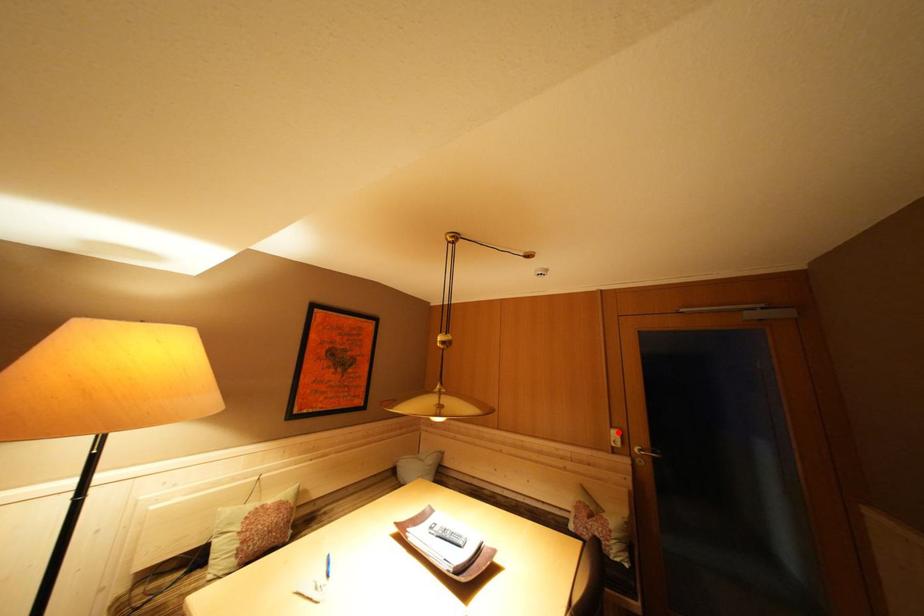
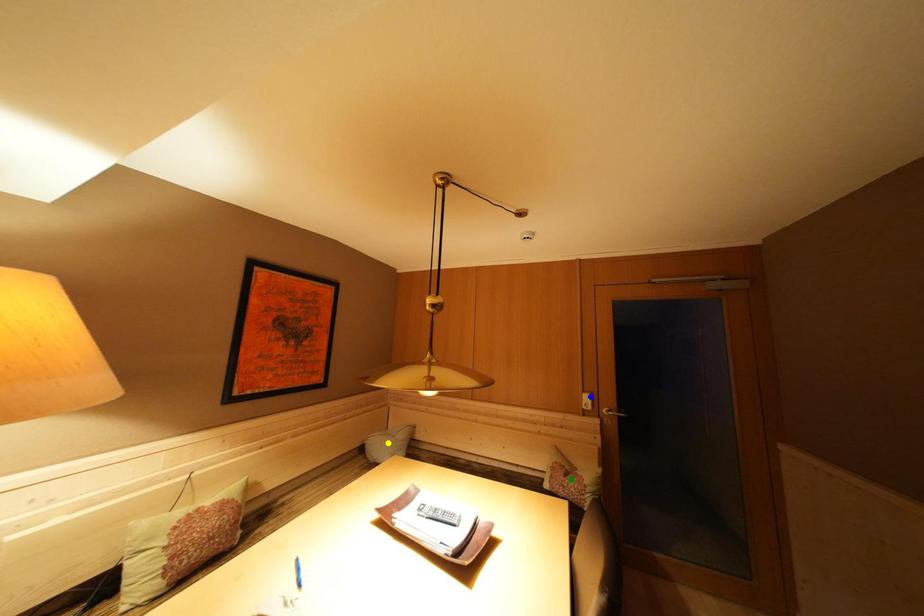
Question: I am providing you with two images of the same scene from different viewpoints. A red point is marked on the first image. You are given multiple points on the second image. Which spot in image 2 lines up with the point in image 1?

Choices:
 (A) blue point
 (B) green point
 (C) yellow point

Answer: (A)